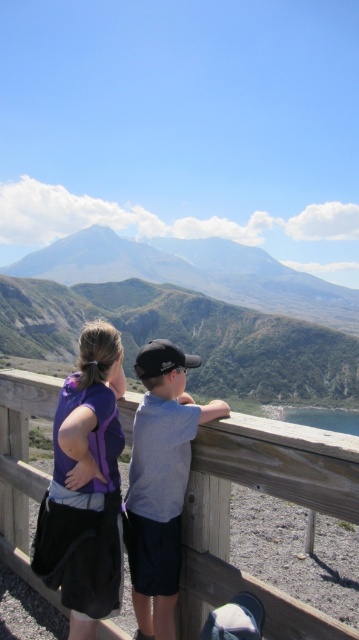
Question: Is green grassy mountain at upper center to the left of gray cotton shirt at upper center from the viewer's perspective?

Choices:
 (A) no
 (B) yes

Answer: (A)

Question: Which of the following is the closest to the observer?

Choices:
 (A) (94, 260)
 (B) (105, 545)

Answer: (B)

Question: Does wooden at center appear on the right side of gray cotton shirt at upper center?

Choices:
 (A) no
 (B) yes

Answer: (B)

Question: Is purple fabric shirt at left above gray cotton shirt at upper center?

Choices:
 (A) no
 (B) yes

Answer: (A)

Question: Which point is farther from the camera taking this photo?

Choices:
 (A) (156, 484)
 (B) (301, 429)
 (C) (171, 285)
 (D) (63, 509)

Answer: (C)

Question: Which point is closer to the camera taking this photo?

Choices:
 (A) (11, 497)
 (B) (170, 538)
 (C) (94, 332)

Answer: (B)